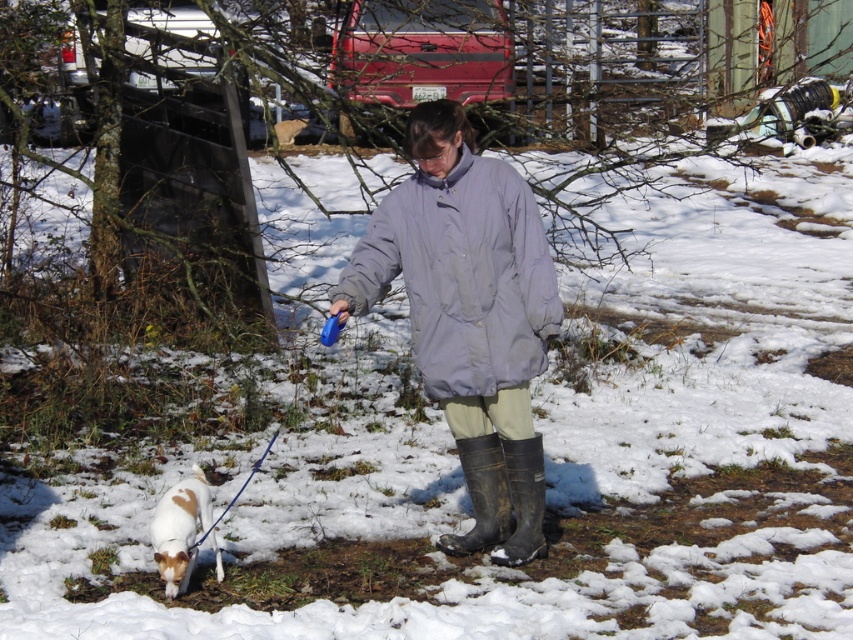
Can you confirm if matte gray jacket at center is wider than rubber/matte boot at lower center?

Yes, matte gray jacket at center is wider than rubber/matte boot at lower center.

Who is taller, matte gray jacket at center or rubber/matte boot at lower center?

With more height is matte gray jacket at center.

Identify the location of matte gray jacket at center. (469, 316).

Image resolution: width=853 pixels, height=640 pixels. Describe the element at coordinates (469, 316) in the screenshot. I see `matte gray jacket at center` at that location.

Which is in front, point (427, 220) or point (445, 545)?

Point (427, 220)

This screenshot has height=640, width=853. Identify the location of matte gray jacket at center. 469,316.

Which is more to the left, black rubber boot at lower center or rubber/matte boot at lower center?

black rubber boot at lower center is more to the left.

Is point (491, 474) more distant than point (523, 515)?

No, (491, 474) is in front of (523, 515).

Where is `black rubber boot at lower center`? Image resolution: width=853 pixels, height=640 pixels. black rubber boot at lower center is located at coordinates (482, 497).